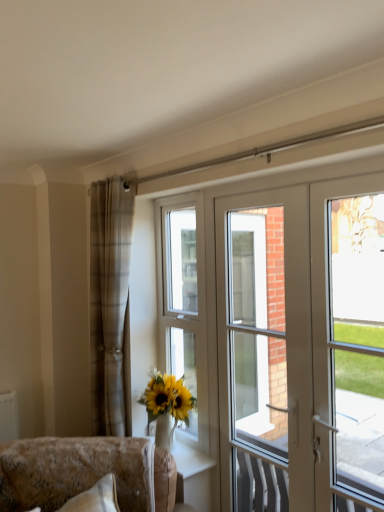
Question: Considering their positions, is white glossy vase at lower center located in front of or behind plaid fabric curtain at left?

Choices:
 (A) front
 (B) behind

Answer: (A)

Question: From the image's perspective, is white glossy vase at lower center positioned above or below plaid fabric curtain at left?

Choices:
 (A) below
 (B) above

Answer: (A)

Question: Based on their relative distances, which object is farther from the white glossy vase at lower center?

Choices:
 (A) clear glass door at right
 (B) white plastic window at center
 (C) velvet beige sofa at lower left
 (D) white glossy door at right
 (E) plaid fabric curtain at left

Answer: (A)

Question: Estimate the real-world distances between objects in this image. Which object is closer to the white plastic window at center?

Choices:
 (A) plaid fabric curtain at left
 (B) clear glass door at right
 (C) white glossy vase at lower center
 (D) velvet beige sofa at lower left
 (E) white glossy door at center

Answer: (A)